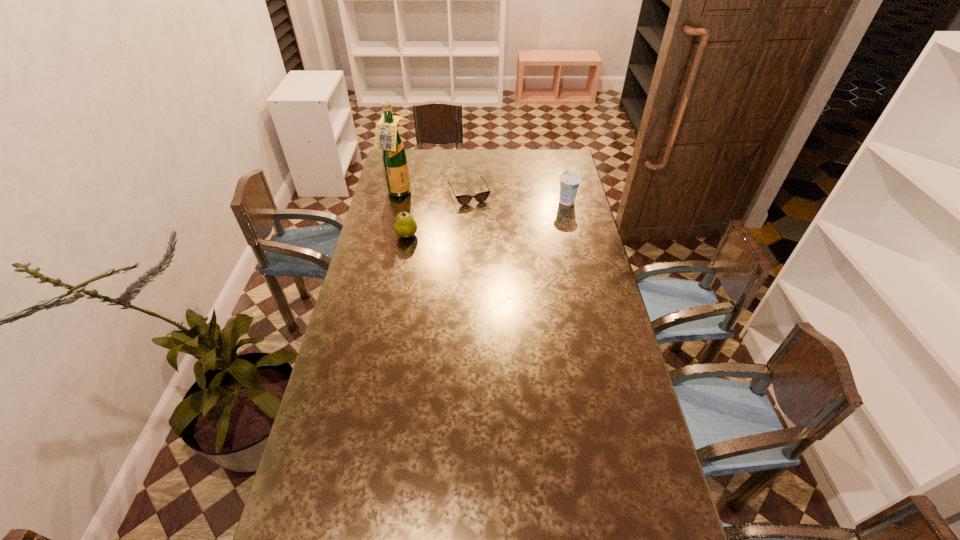
In order to click on free spot located 0.100m on the front lenses of the sunglasses in this screenshot , I will do `click(480, 219)`.

At what (x,y) coordinates should I click in order to perform the action: click on free space located 0.240m on the front lenses of the sunglasses. Please return your answer as a coordinate pair (x, y). Image resolution: width=960 pixels, height=540 pixels. Looking at the image, I should click on (490, 239).

Image resolution: width=960 pixels, height=540 pixels. What are the coordinates of `vacant area located on the front lenses of the sunglasses` in the screenshot? It's located at (490, 239).

You are a GUI agent. You are given a task and a screenshot of the screen. Output one action in this format:
    pyautogui.click(x=<x>, y=<y>)
    Task: Click on the pear at the left edge
    This screenshot has width=960, height=540.
    Given the screenshot: What is the action you would take?
    pyautogui.click(x=405, y=226)

Identify the location of liquor positioned at the left edge. (394, 157).

The width and height of the screenshot is (960, 540). I want to click on object situated at the right edge, so click(x=569, y=182).

Locate an element on the screen. Image resolution: width=960 pixels, height=540 pixels. free region at the left edge is located at coordinates point(373,213).

In the image, there is a desktop. At what (x,y) coordinates should I click in order to perform the action: click on vacant space at the right edge. Please return your answer as a coordinate pair (x, y). Looking at the image, I should click on (639, 479).

In the image, there is a desktop. Where is `vacant space at the near right corner`? vacant space at the near right corner is located at coordinates (624, 518).

Where is `vacant space that's between the yogurt and the shortest object`? vacant space that's between the yogurt and the shortest object is located at coordinates (517, 197).